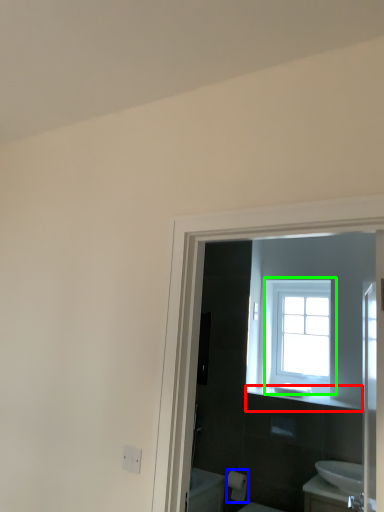
Question: Estimate the real-world distances between objects in this image. Which object is farther from balustrade (highlighted by a red box), toilet paper (highlighted by a blue box) or window (highlighted by a green box)?

Choices:
 (A) toilet paper
 (B) window

Answer: (A)